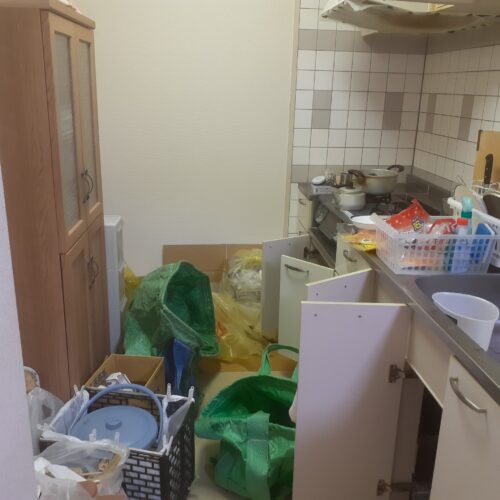
Locate an element on the screen. basin is located at coordinates (482, 341), (441, 281).